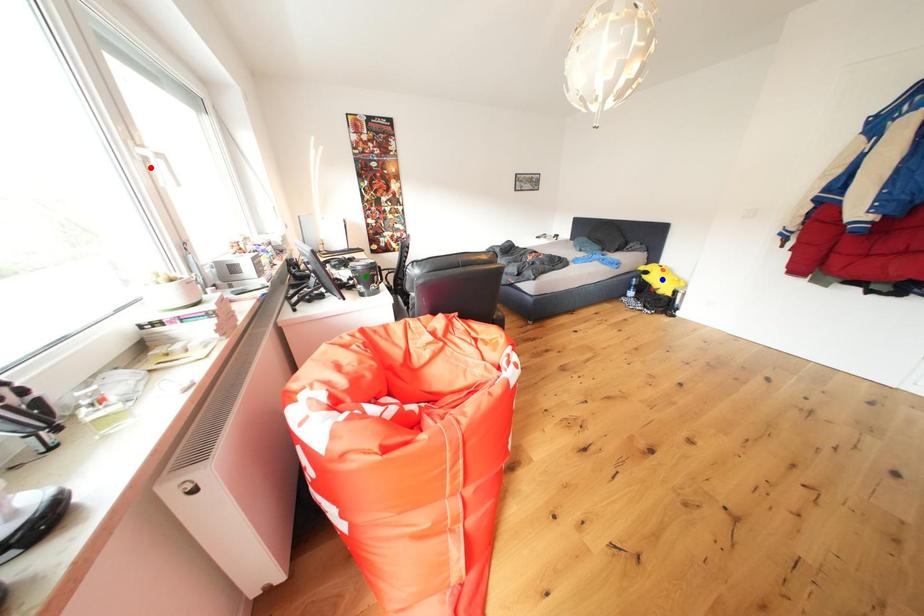
Looking at this image, order these from farthest to nearest:
green point
red point
blue point

blue point < green point < red point